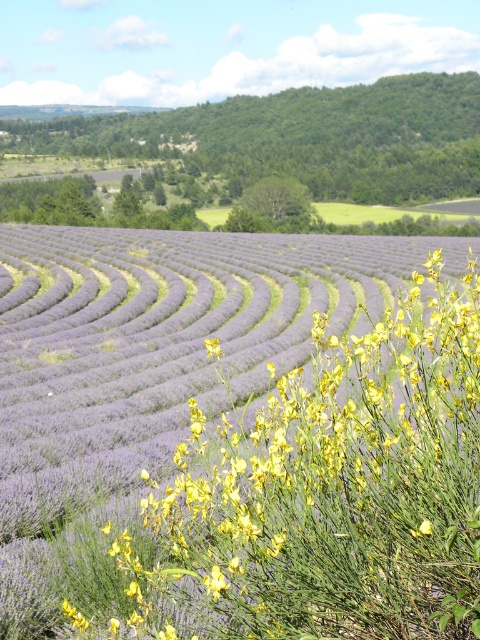
You are standing in the middle of the lavender field and want to take a photo of the purple soft lavender at center. According to the coordinates provided, where should you aim your camera to capture it?

You should aim your camera at the coordinates point (153, 358) to capture the purple soft lavender at center.